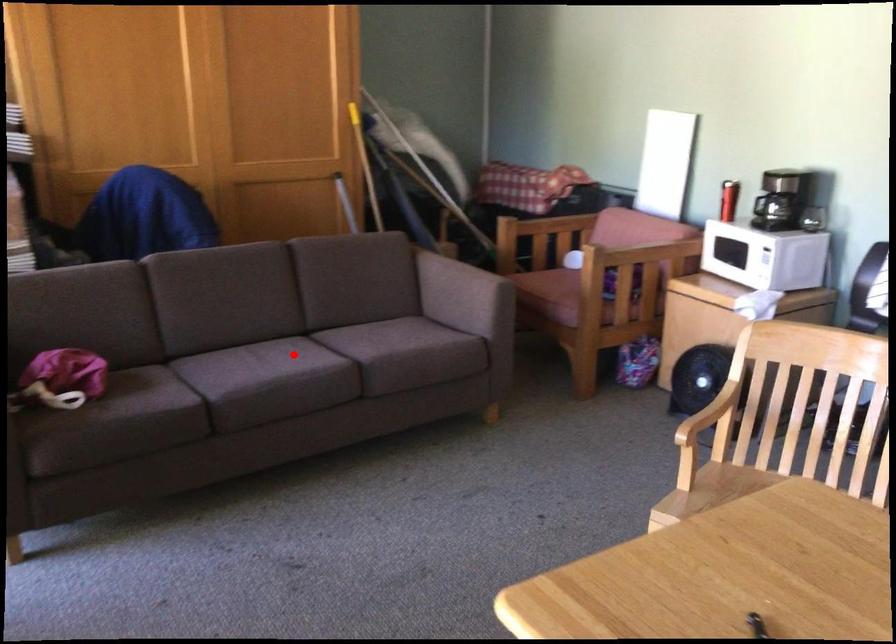
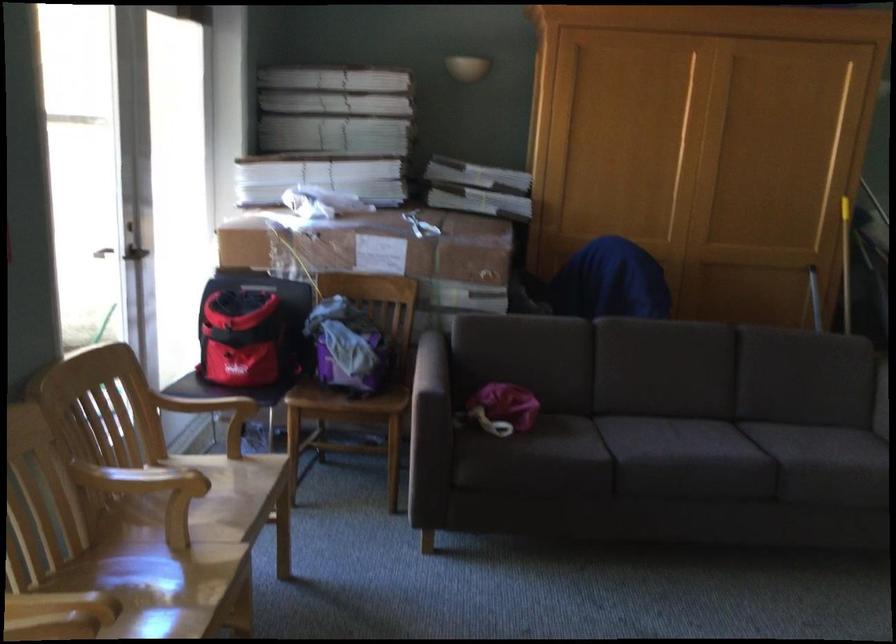
The point at the highlighted location is marked in the first image. Where is the corresponding point in the second image?

(724, 439)